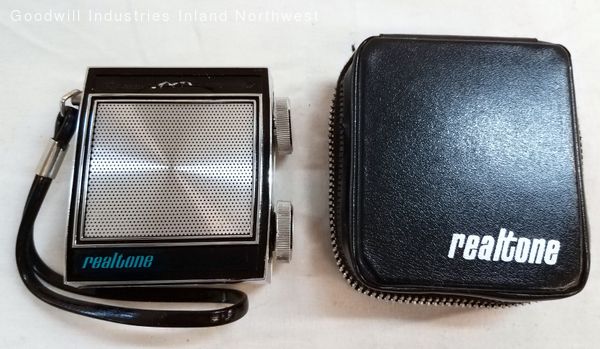
The height and width of the screenshot is (349, 600). Find the location of `speaker`. speaker is located at coordinates (160, 164).